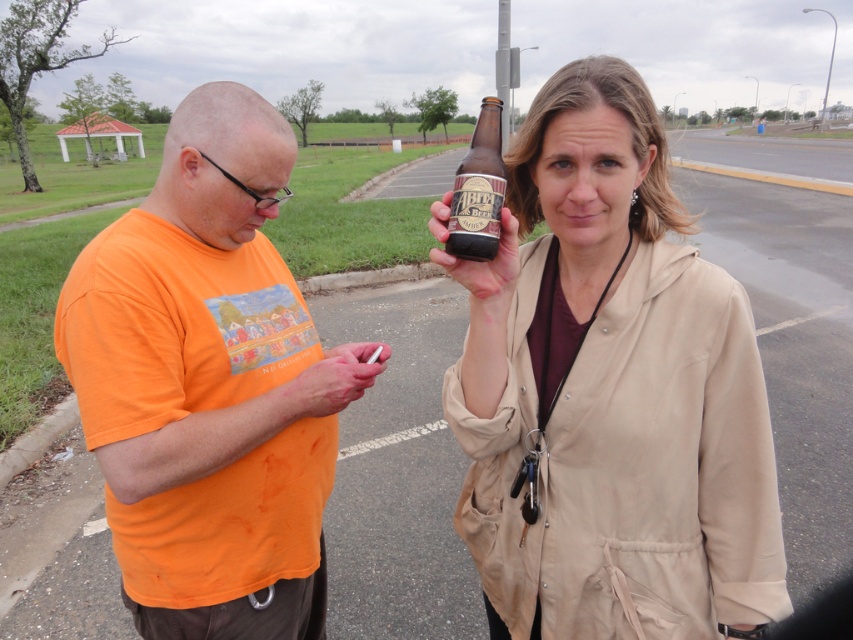
Question: Which of these objects is positioned closest to the orange cotton shirt at center?

Choices:
 (A) matte brown bottle at center
 (B) brown glass bottle at center

Answer: (A)

Question: Which object appears closest to the camera in this image?

Choices:
 (A) matte brown bottle at center
 (B) orange cotton shirt at center

Answer: (A)

Question: Can you confirm if matte brown bottle at center is positioned above orange cotton shirt at center?

Choices:
 (A) yes
 (B) no

Answer: (A)

Question: Considering the relative positions of matte brown bottle at center and orange cotton shirt at center in the image provided, where is matte brown bottle at center located with respect to orange cotton shirt at center?

Choices:
 (A) below
 (B) above

Answer: (B)

Question: Is matte brown bottle at center bigger than orange cotton shirt at center?

Choices:
 (A) yes
 (B) no

Answer: (B)

Question: Considering the real-world distances, which object is farthest from the matte brown bottle at center?

Choices:
 (A) orange cotton shirt at center
 (B) brown glass bottle at center

Answer: (A)